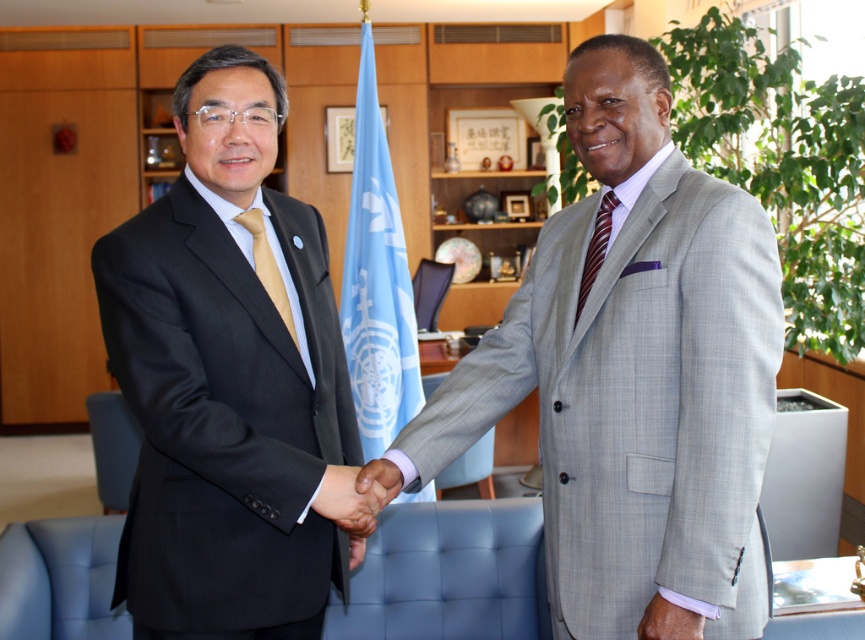
You are standing in the office scene where two men are shaking hands. There is a point marked at coordinates (633, 371). What object is located at that point?

The point at coordinates (633, 371) indicates the gray textured suit at center.

You are an event planner arranging a photo shoot for a United Nations event. You need to ensure that the light blue fabric flag at center and the smooth skin handshake at center are visible in the photo. Given their relative sizes, which object will occupy more space in the final image?

The light blue fabric flag at center is much taller than the smooth skin handshake at center, so it will occupy more space in the final image.